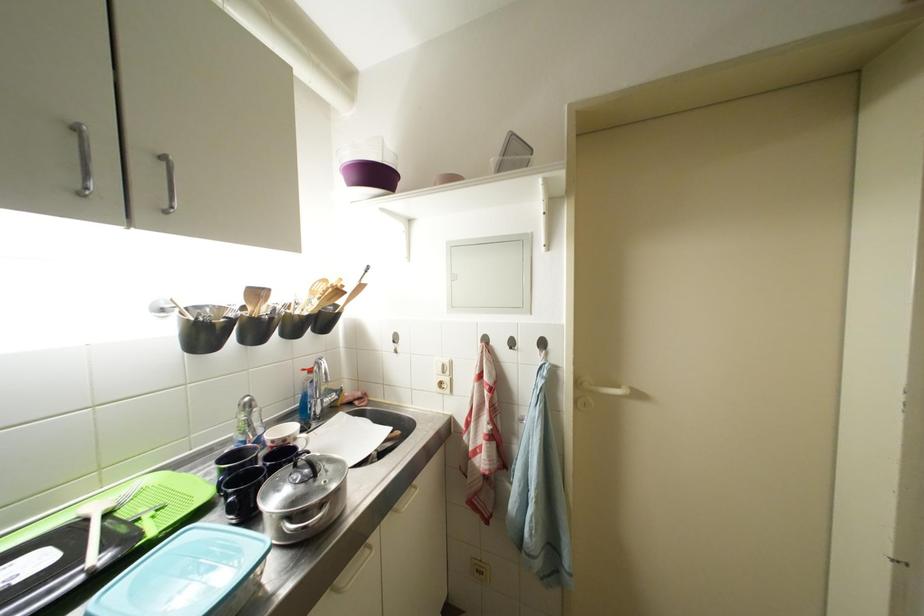
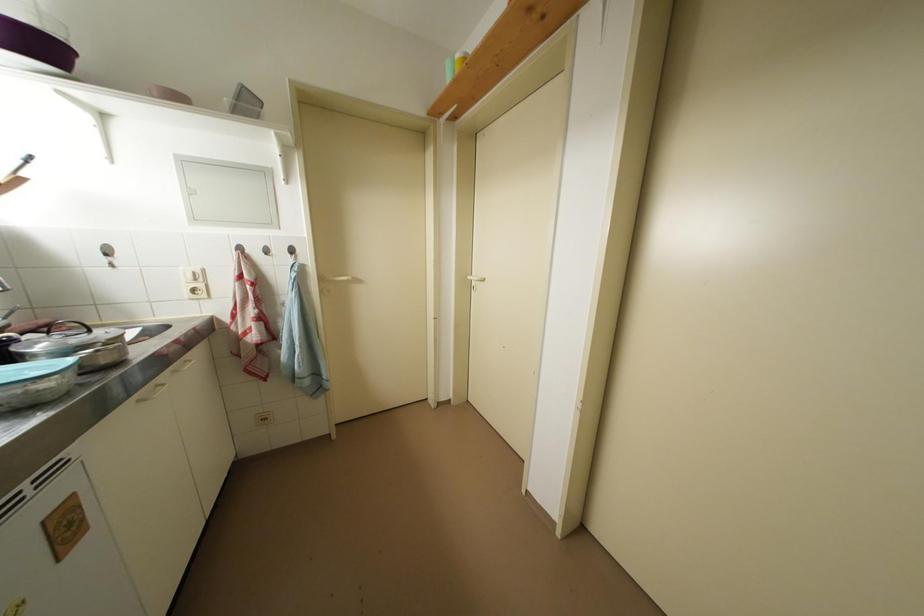
Question: The camera is either moving clockwise (left) or counter-clockwise (right) around the object. The first image is from the beginning of the video and the second image is from the end. Is the camera moving left or right when shooting the video?

Choices:
 (A) Left
 (B) Right

Answer: (A)